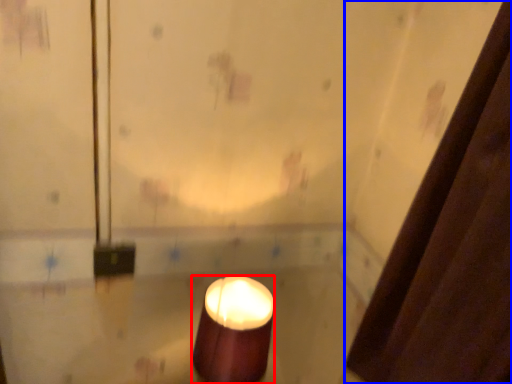
Question: Which point is further to the camera, candle (highlighted by a red box) or shower curtain (highlighted by a blue box)?

Choices:
 (A) candle
 (B) shower curtain

Answer: (A)